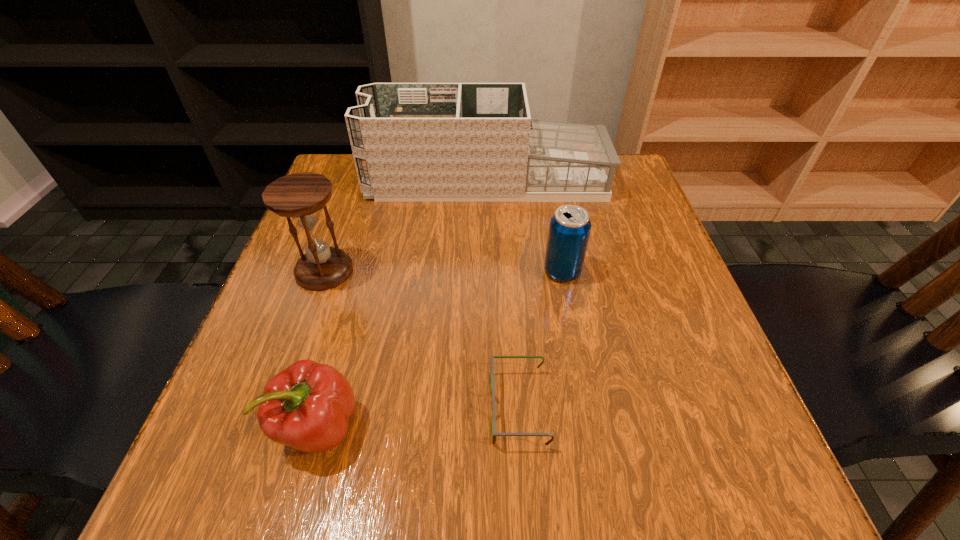
Locate an element on the screen. object located at the near left corner is located at coordinates (307, 406).

The image size is (960, 540). In order to click on object that is positioned at the far right corner in this screenshot , I will do `click(411, 142)`.

Where is `free location at the near edge`? This screenshot has height=540, width=960. free location at the near edge is located at coordinates pyautogui.click(x=494, y=448).

In the image, there is a desktop. In order to click on vacant region at the left edge in this screenshot , I will do `click(363, 231)`.

Find the location of a particular element. blank space at the right edge of the desktop is located at coordinates (655, 339).

This screenshot has width=960, height=540. In order to click on vacant space at the far left corner in this screenshot , I will do `click(353, 168)`.

Where is `vacant space at the near right corner of the desktop`? Image resolution: width=960 pixels, height=540 pixels. vacant space at the near right corner of the desktop is located at coordinates (717, 495).

Find the location of `unoccupied area between the spectacles and the hourglass`. unoccupied area between the spectacles and the hourglass is located at coordinates (421, 339).

Locate an element on the screen. This screenshot has width=960, height=540. empty location between the shortest object and the fourth tallest object is located at coordinates (419, 417).

Where is `vacant point located between the spectacles and the hourglass`? vacant point located between the spectacles and the hourglass is located at coordinates (421, 339).